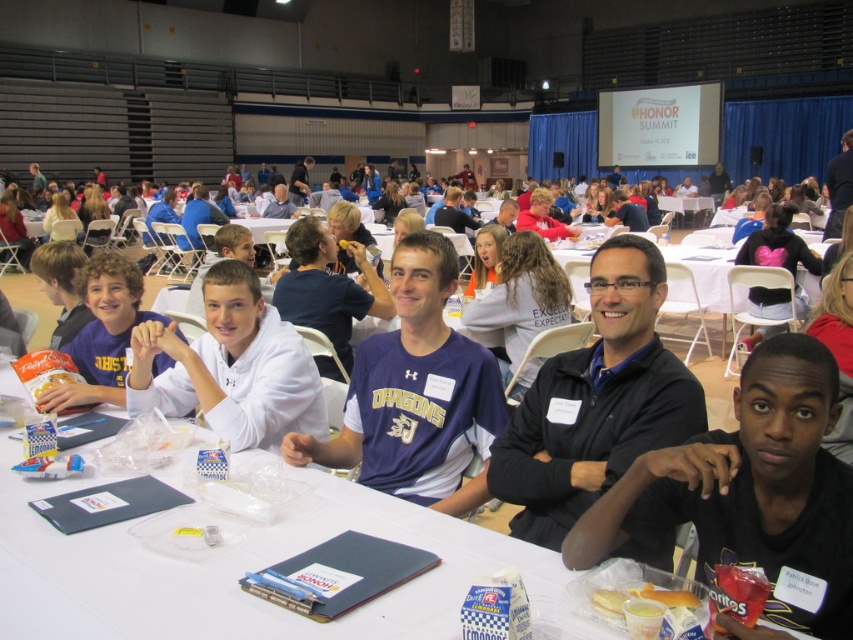
You are standing in the room and want to place a small object on the table between the two points labeled point (242, 284) and point (129, 260). Which point is closer to you so you can reach it first?

Point (242, 284) is closer to the viewer than point (129, 260), so you can reach it first.